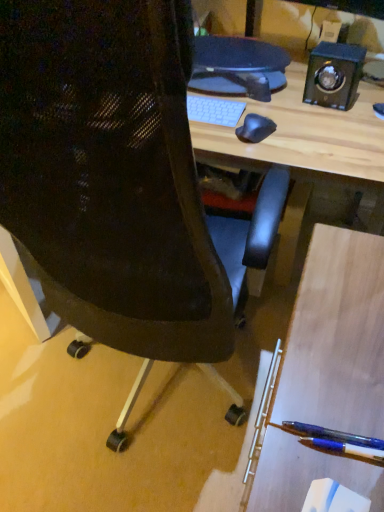
Identify the location of free region under black mesh chair at center (from a real-world perspective). Image resolution: width=384 pixels, height=512 pixels. (147, 402).